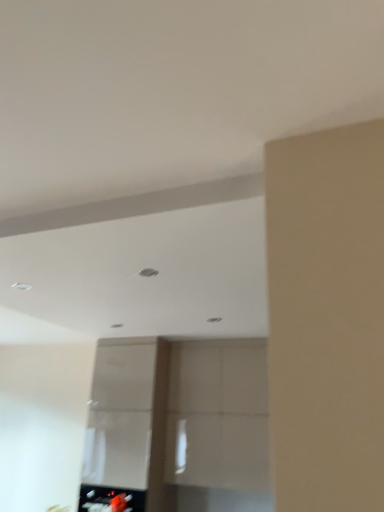
Describe the element at coordinates (110, 499) in the screenshot. I see `metallic silver toaster at lower center` at that location.

This screenshot has height=512, width=384. Identify the location of metallic silver toaster at lower center. (110, 499).

Identify the location of metallic silver toaster at lower center. (110, 499).